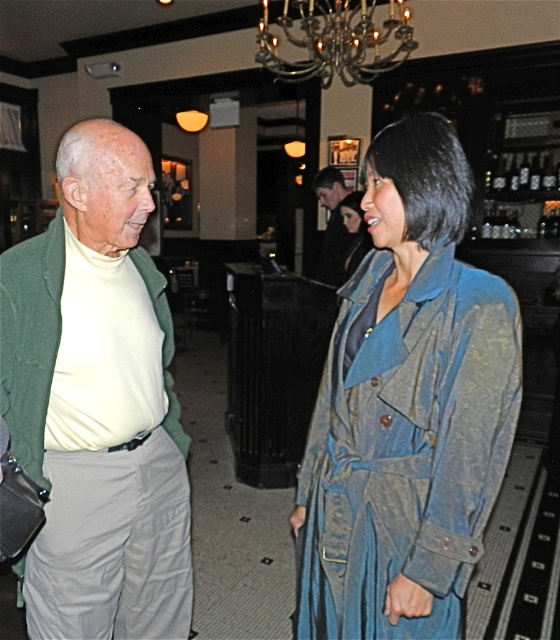
Question: Among these objects, which one is farthest from the camera?

Choices:
 (A) smooth black hair at upper center
 (B) blue denim trench coat at center
 (C) denim jacket at center

Answer: (A)

Question: Is smooth black hair at upper center below denim jacket at center?

Choices:
 (A) no
 (B) yes

Answer: (A)

Question: Which point appears farthest from the camera in this image?

Choices:
 (A) (356, 212)
 (B) (343, 240)
 (C) (146, 196)
 (D) (310, 70)

Answer: (D)

Question: Does blue denim trench coat at center appear on the left side of smooth black hair at upper center?

Choices:
 (A) no
 (B) yes

Answer: (B)

Question: Does green wool sweater at left have a lesser width compared to silver metallic chandelier at upper center?

Choices:
 (A) no
 (B) yes

Answer: (B)

Question: Which of the following is the closest to the observer?

Choices:
 (A) blue denim trench coat at center
 (B) silver metallic chandelier at upper center
 (C) smooth black hair at upper center

Answer: (A)